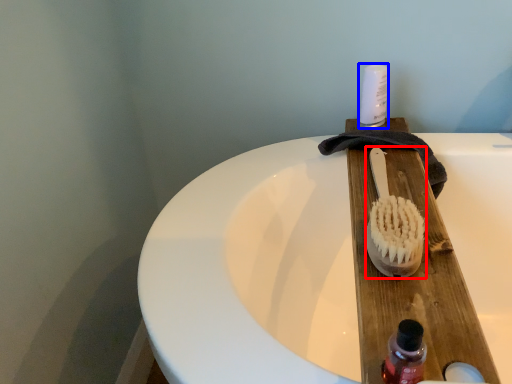
Question: Which object appears closest to the camera in this image, brush (highlighted by a red box) or toiletry (highlighted by a blue box)?

Choices:
 (A) brush
 (B) toiletry

Answer: (A)